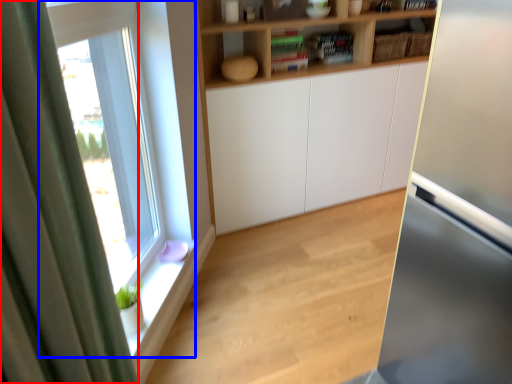
Question: Which of the following is the closest to the observer, curtain (highlighted by a red box) or window (highlighted by a blue box)?

Choices:
 (A) curtain
 (B) window

Answer: (A)